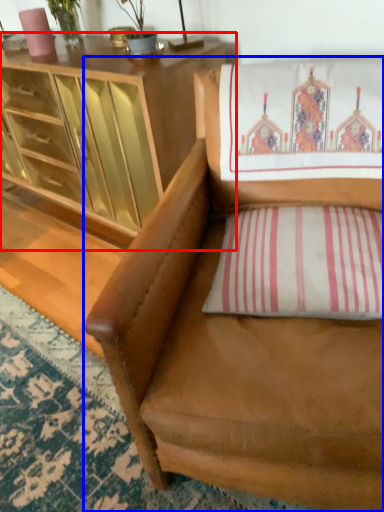
Question: Which point is closer to the camera, cabinetry (highlighted by a red box) or chair (highlighted by a blue box)?

Choices:
 (A) cabinetry
 (B) chair

Answer: (B)